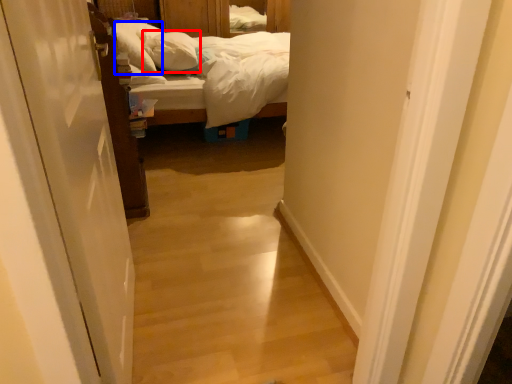
Question: Which object is further to the camera taking this photo, pillow (highlighted by a red box) or pillow (highlighted by a blue box)?

Choices:
 (A) pillow
 (B) pillow

Answer: (A)